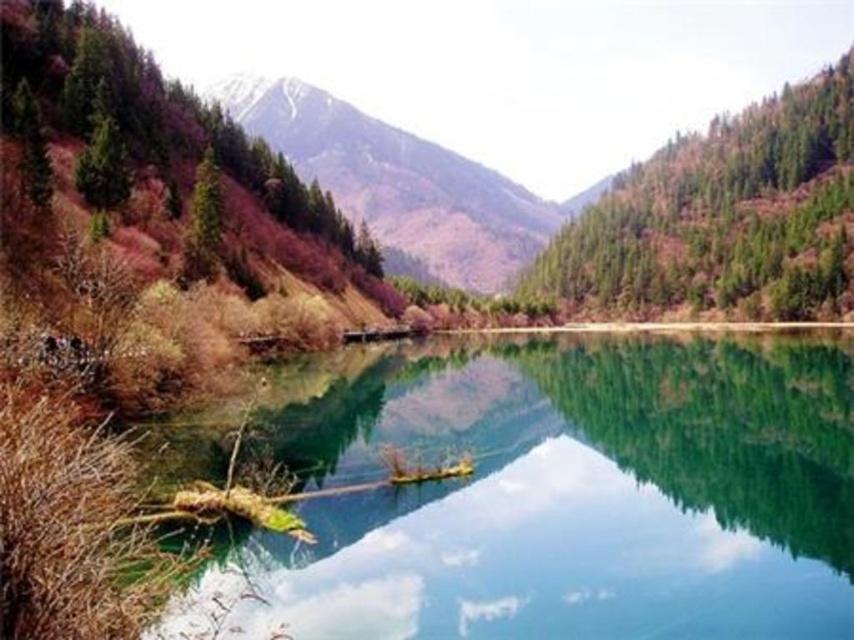
Based on the photo, is green matte forest at upper center below green forested mountain at upper center?

Yes.

Who is positioned more to the left, green matte forest at upper center or green forested mountain at upper center?

Positioned to the left is green forested mountain at upper center.

Does point (738, 134) come farther from viewer compared to point (428, 250)?

No, (738, 134) is closer to viewer.

Where is `green matte forest at upper center`? The height and width of the screenshot is (640, 854). green matte forest at upper center is located at coordinates (724, 216).

Measure the distance from green smooth water at center to green matte tree at upper left.

They are 252.94 feet apart.

Does point (600, 420) lie behind point (194, 221)?

Yes, it is behind point (194, 221).

Where is `green smooth water at center`? This screenshot has height=640, width=854. green smooth water at center is located at coordinates (562, 497).

Does green forested mountain at upper center appear on the right side of green matte tree at upper left?

No, green forested mountain at upper center is not to the right of green matte tree at upper left.

Measure the distance between point (431, 172) and camera.

652.33 meters

Locate an element on the screen. green forested mountain at upper center is located at coordinates (396, 180).